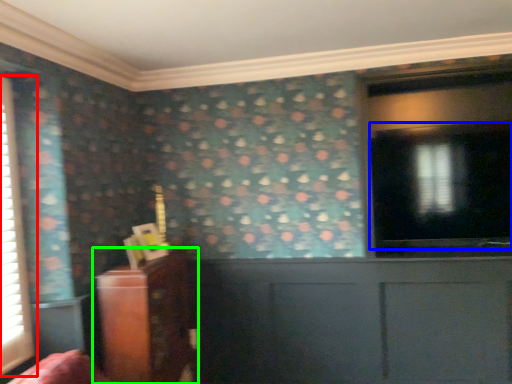
Question: Which is farther away from window (highlighted by a red box)? window screen (highlighted by a blue box) or furniture (highlighted by a green box)?

Choices:
 (A) window screen
 (B) furniture

Answer: (A)